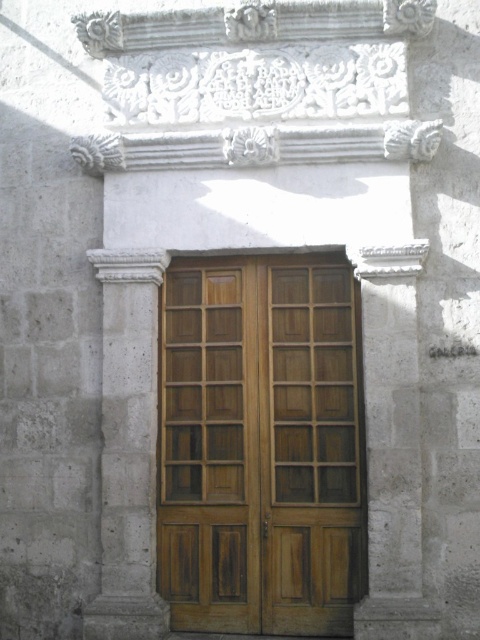
You are standing in front of the building and notice a point at coordinates (261, 445). Based on the scene description, what object is located at that point?

The point at coordinates (261, 445) corresponds to the wooden and glass door at center.